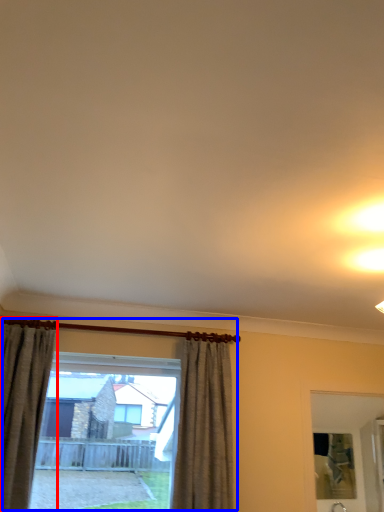
Question: Which point is further to the camera, curtain (highlighted by a red box) or window (highlighted by a blue box)?

Choices:
 (A) curtain
 (B) window

Answer: (B)